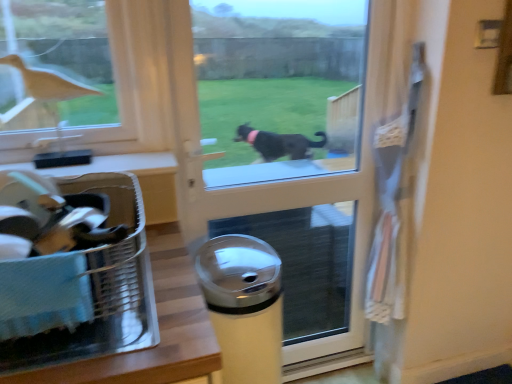
Question: Should I look upward or downward to see transparent glass screen door at center?

Choices:
 (A) down
 (B) up

Answer: (A)

Question: Is the depth of translucent plastic laundry basket at lower left greater than that of matte brown bird at upper left?

Choices:
 (A) yes
 (B) no

Answer: (B)

Question: Considering the relative sizes of translucent plastic laundry basket at lower left and matte brown bird at upper left in the image provided, is translucent plastic laundry basket at lower left thinner than matte brown bird at upper left?

Choices:
 (A) no
 (B) yes

Answer: (A)

Question: Does translucent plastic laundry basket at lower left have a lesser height compared to matte brown bird at upper left?

Choices:
 (A) yes
 (B) no

Answer: (A)

Question: Can you confirm if translucent plastic laundry basket at lower left is smaller than matte brown bird at upper left?

Choices:
 (A) no
 (B) yes

Answer: (A)

Question: Is translucent plastic laundry basket at lower left not near matte brown bird at upper left?

Choices:
 (A) yes
 (B) no

Answer: (B)

Question: From the image's perspective, would you say translucent plastic laundry basket at lower left is shown under matte brown bird at upper left?

Choices:
 (A) yes
 (B) no

Answer: (A)

Question: From a real-world perspective, is translucent plastic laundry basket at lower left positioned over transparent glass screen door at center based on gravity?

Choices:
 (A) yes
 (B) no

Answer: (A)

Question: Could you tell me if translucent plastic laundry basket at lower left is facing transparent glass screen door at center?

Choices:
 (A) no
 (B) yes

Answer: (A)

Question: Considering the relative sizes of translucent plastic laundry basket at lower left and transparent glass screen door at center in the image provided, is translucent plastic laundry basket at lower left taller than transparent glass screen door at center?

Choices:
 (A) yes
 (B) no

Answer: (B)

Question: Can you confirm if translucent plastic laundry basket at lower left is shorter than transparent glass screen door at center?

Choices:
 (A) yes
 (B) no

Answer: (A)

Question: From the image's perspective, is translucent plastic laundry basket at lower left on transparent glass screen door at center?

Choices:
 (A) no
 (B) yes

Answer: (A)

Question: Is translucent plastic laundry basket at lower left at the left side of transparent glass screen door at center?

Choices:
 (A) yes
 (B) no

Answer: (A)

Question: From the image's perspective, would you say transparent glass screen door at center is positioned over matte brown bird at upper left?

Choices:
 (A) no
 (B) yes

Answer: (A)